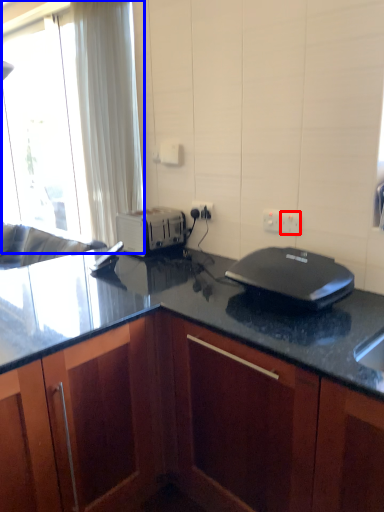
Question: Which of the following is the closest to the observer, electric outlet (highlighted by a red box) or window (highlighted by a blue box)?

Choices:
 (A) electric outlet
 (B) window

Answer: (A)